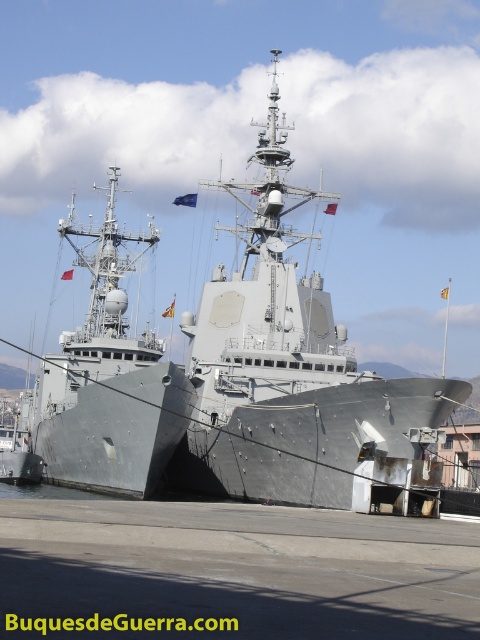
You are a dock worker who needs to secure both the gray metallic ship at center and the gray metallic ship at left. Since the ships have different heights, which ship requires a taller crane to lift cargo onto its deck?

The gray metallic ship at center requires a taller crane because it has a greater height compared to the gray metallic ship at left.

You are a port authority inspector tasked with ensuring that the two gray metallic ships are properly spaced for safety. According to regulations, the larger ship must be positioned at least 50 meters away from the smaller one to allow for safe maneuvering. Based on the image, can you determine if the spacing between the gray metallic ship at center and the gray metallic ship at left meets the safety requirement?

The gray metallic ship at center is larger in size than the gray metallic ship at left. However, the image does not provide specific distance measurements between the two ships. Without knowing the actual distance, it is impossible to confirm if the spacing meets the 50 meters safety requirement.

You are a dock worker who needs to secure both the gray metallic ship at center and the gray metallic ship at left to the dock. Which ship requires more ropes to secure due to its size?

The gray metallic ship at left requires more ropes to secure because it is wider than the gray metallic ship at center.